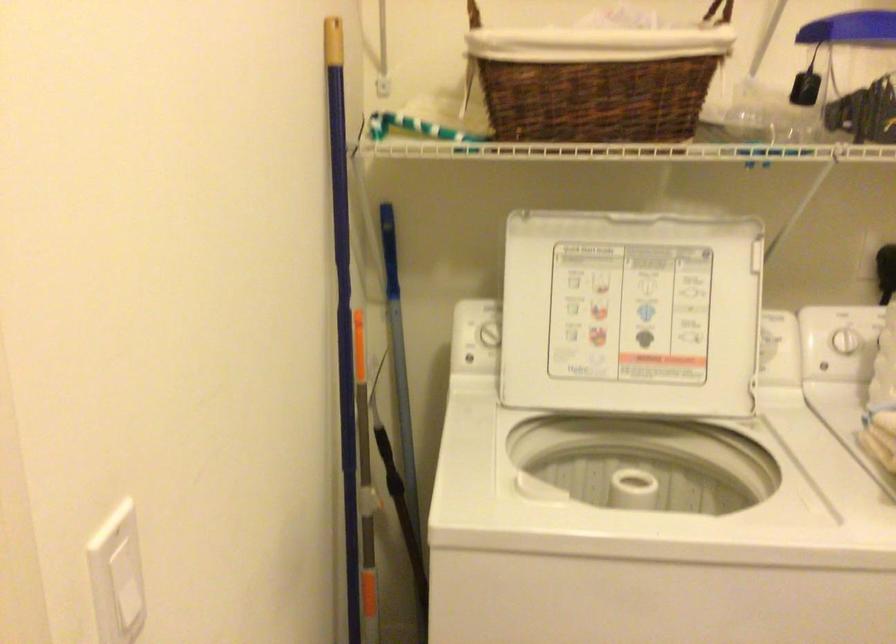
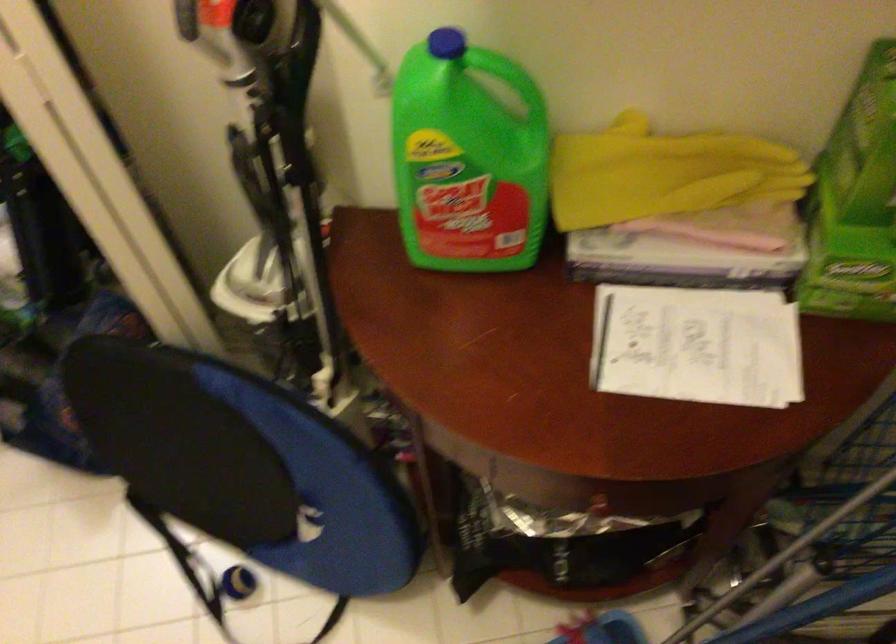
The images are taken continuously from a first-person perspective. In which direction is your viewpoint rotating?

The rotation direction of the camera is right-down.